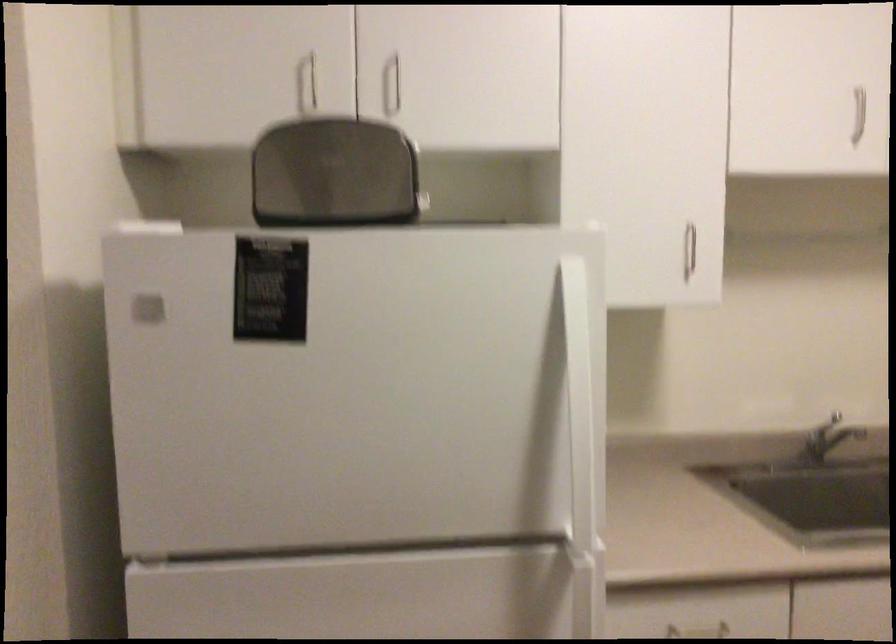
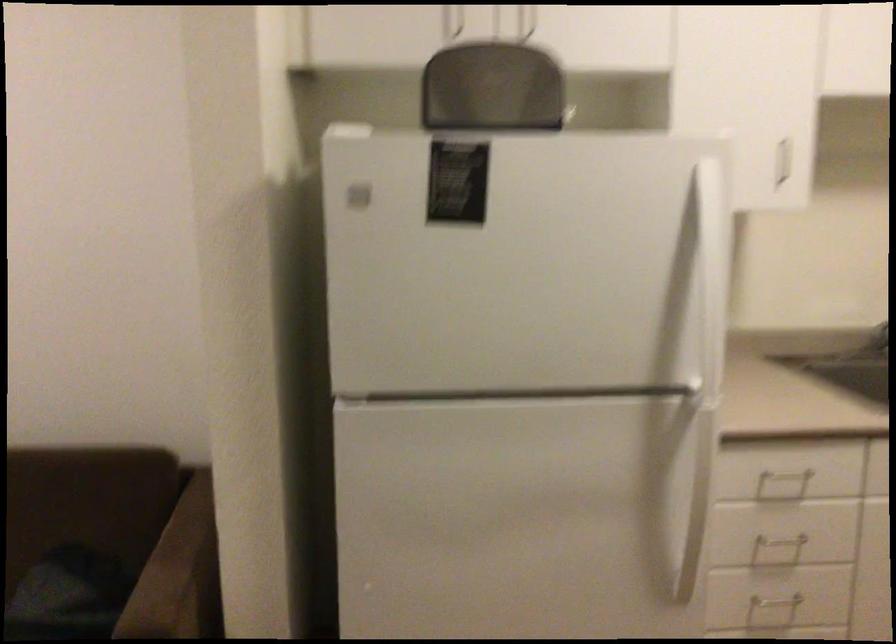
The point at (688, 257) is marked in the first image. Where is the corresponding point in the second image?

(785, 160)